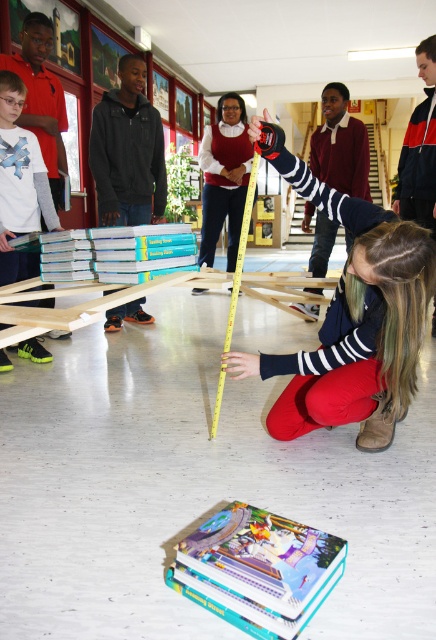
Question: Which point appears closest to the camera in this image?

Choices:
 (A) (272, 419)
 (B) (159, 236)

Answer: (A)

Question: Which point is closer to the camera taking this photo?

Choices:
 (A) (314, 380)
 (B) (208, 582)

Answer: (B)

Question: Is hardcover book at center smaller than hardcover books at center?

Choices:
 (A) no
 (B) yes

Answer: (B)

Question: Among these objects, which one is farthest from the camera?

Choices:
 (A) hardcover book at center
 (B) matte black tape measure at center
 (C) neon green sneakers at left

Answer: (C)

Question: Is neon green sneakers at left further to the viewer compared to yellow/yellowish plastic tape measure at center?

Choices:
 (A) no
 (B) yes

Answer: (B)

Question: In this image, where is matte black tape measure at center located relative to hardcover books at center?

Choices:
 (A) left
 (B) right

Answer: (B)